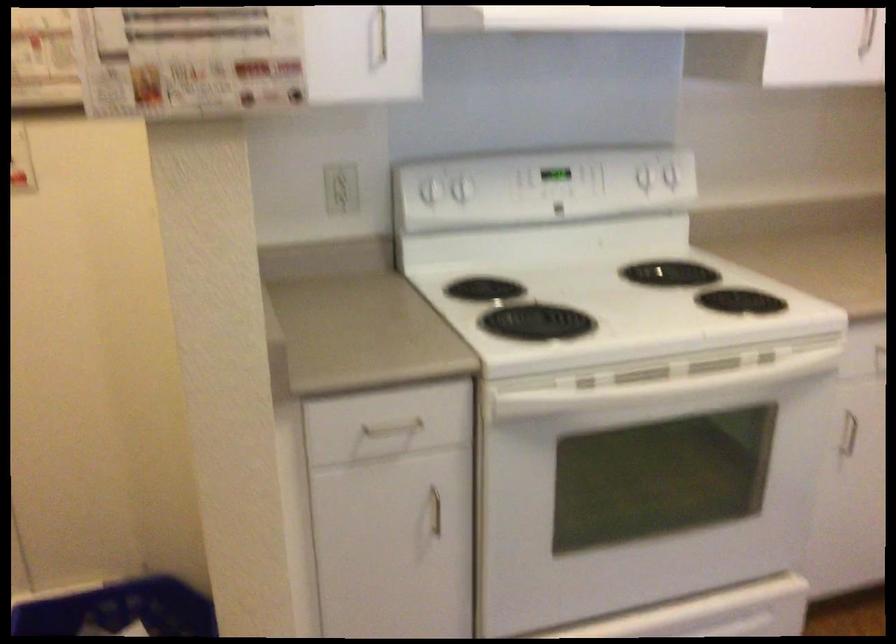
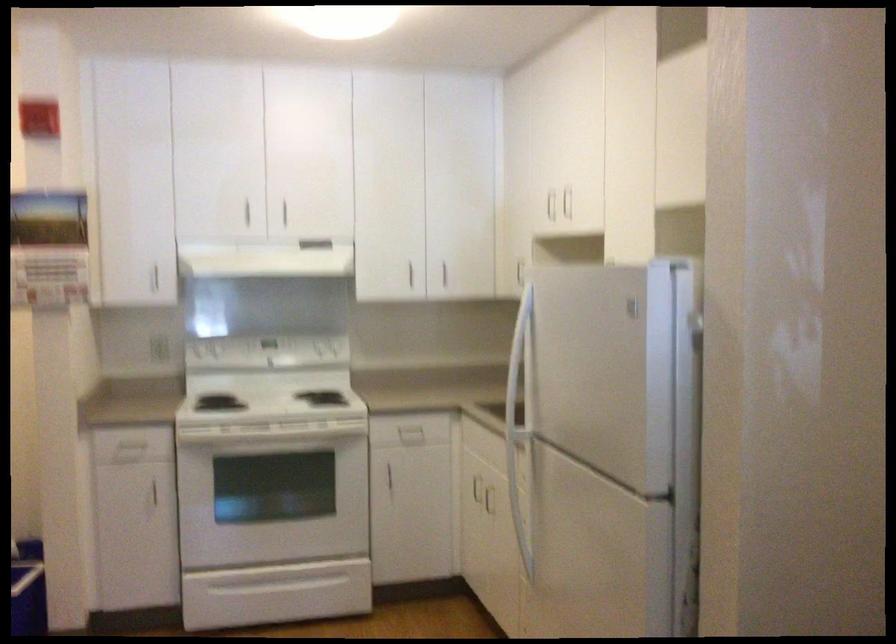
What movement of the cameraman would produce the second image?

The movement direction of the cameraman is right, backward.